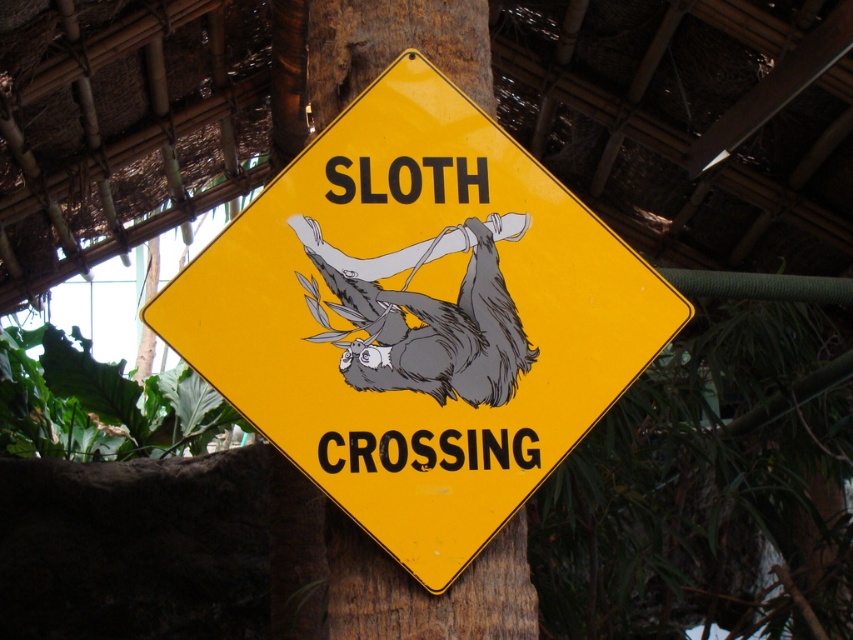
Can you confirm if yellow matte sign at center is positioned below gray matte sloth at center?

Yes, yellow matte sign at center is below gray matte sloth at center.

Can you confirm if yellow matte sign at center is smaller than gray matte sloth at center?

No, yellow matte sign at center is not smaller than gray matte sloth at center.

You are a GUI agent. You are given a task and a screenshot of the screen. Output one action in this format:
    pyautogui.click(x=<x>, y=<y>)
    Task: Click on the yellow matte sign at center
    Image resolution: width=853 pixels, height=640 pixels.
    Given the screenshot: What is the action you would take?
    pyautogui.click(x=418, y=317)